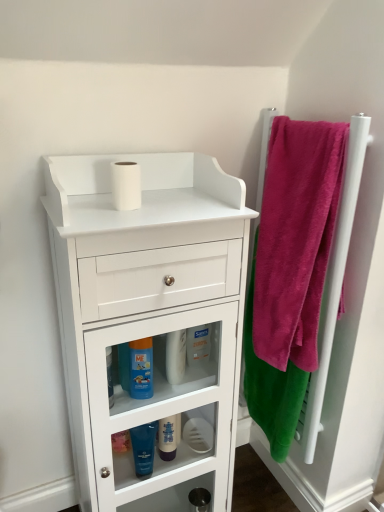
At what (x,y) coordinates should I click in order to perform the action: click on white matte toilet paper at center, which is counted as the 2th toilet paper, starting from the top. Please return your answer as a coordinate pair (x, y). This screenshot has height=512, width=384. Looking at the image, I should click on (198, 435).

What do you see at coordinates (271, 386) in the screenshot?
I see `velvet pink towel at right` at bounding box center [271, 386].

This screenshot has height=512, width=384. What do you see at coordinates (147, 309) in the screenshot?
I see `white matte cabinet at center` at bounding box center [147, 309].

I want to click on translucent plastic mouthwash at lower center, the second mouthwash positioned from the top, so click(x=167, y=438).

Considering the relative positions of blue glossy mouthwash at lower center, positioned as the 3th mouthwash in top-to-bottom order, and white matte toilet paper at center, the 1th toilet paper when ordered from right to left, in the image provided, is blue glossy mouthwash at lower center, positioned as the 3th mouthwash in top-to-bottom order, to the left of white matte toilet paper at center, the 1th toilet paper when ordered from right to left, from the viewer's perspective?

Indeed, blue glossy mouthwash at lower center, positioned as the 3th mouthwash in top-to-bottom order, is positioned on the left side of white matte toilet paper at center, the 1th toilet paper when ordered from right to left.

Considering the positions of points (136, 432) and (188, 440), is point (136, 432) farther from camera compared to point (188, 440)?

No.

From a real-world perspective, is blue glossy mouthwash at lower center, positioned as the 3th mouthwash in top-to-bottom order, beneath white matte toilet paper at center, which is counted as the 2th toilet paper, starting from the top?

No, from a real-world perspective, blue glossy mouthwash at lower center, positioned as the 3th mouthwash in top-to-bottom order, is not below white matte toilet paper at center, which is counted as the 2th toilet paper, starting from the top.

Find the location of `the 3rd mouthwash counting from the left of the white matte toilet paper at center, the 1th toilet paper when ordered from right to left`. the 3rd mouthwash counting from the left of the white matte toilet paper at center, the 1th toilet paper when ordered from right to left is located at coordinates (144, 447).

In the scene shown: Is velvet pink towel at right inside blue glossy mouthwash at lower center, which is the 3th mouthwash in bottom-to-top order?

Actually, velvet pink towel at right is outside blue glossy mouthwash at lower center, which is the 3th mouthwash in bottom-to-top order.

From the image's perspective, which is above, blue glossy mouthwash at lower center, the first mouthwash in the top-to-bottom sequence, or velvet pink towel at right?

velvet pink towel at right, from the image's perspective.

Which is farther from the camera, [142,392] or [255,239]?

Point [255,239]

Are velvet pink towel at right and blue glossy mouthwash at lower center, which is the 3th mouthwash in bottom-to-top order, located far from each other?

No, velvet pink towel at right is not far away from blue glossy mouthwash at lower center, which is the 3th mouthwash in bottom-to-top order.

From the image's perspective, is velvet pink towel at right located above blue glossy mouthwash at lower center, the first mouthwash in the top-to-bottom sequence?

Indeed, from the image's perspective, velvet pink towel at right is shown above blue glossy mouthwash at lower center, the first mouthwash in the top-to-bottom sequence.

Who is bigger, velvet pink towel at right or blue glossy mouthwash at lower center, the first mouthwash in the top-to-bottom sequence?

velvet pink towel at right.

Between velvet pink towel at right and blue glossy mouthwash at lower center, the first mouthwash in the top-to-bottom sequence, which one has more height?

velvet pink towel at right.

Would you say white plastic bottle at center is to the left or to the right of velvet pink towel at right in the picture?

white plastic bottle at center is to the left of velvet pink towel at right.

From a real-world perspective, is white plastic bottle at center on top of velvet pink towel at right?

Correct, in the physical world, white plastic bottle at center is higher than velvet pink towel at right.

How distant is white plastic bottle at center from velvet pink towel at right?

white plastic bottle at center is 13.11 inches away from velvet pink towel at right.

In the scene shown: From the image's perspective, does white plastic bottle at center appear lower than velvet pink towel at right?

No, from the image's perspective, white plastic bottle at center is not below velvet pink towel at right.

Looking at this image, from the image's perspective, is white matte cabinet at center located beneath translucent plastic mouthwash at lower center, the second mouthwash ordered from the bottom?

No, from the image's perspective, white matte cabinet at center is not below translucent plastic mouthwash at lower center, the second mouthwash ordered from the bottom.

There is a translucent plastic mouthwash at lower center, the second mouthwash positioned from the top. At what (x,y) coordinates should I click in order to perform the action: click on the chest of drawers above it (from a real-world perspective). Please return your answer as a coordinate pair (x, y). The height and width of the screenshot is (512, 384). Looking at the image, I should click on (147, 309).

Which is correct: white matte cabinet at center is inside translucent plastic mouthwash at lower center, the second mouthwash positioned from the top, or outside of it?

white matte cabinet at center is spatially situated outside translucent plastic mouthwash at lower center, the second mouthwash positioned from the top.

Is white matte cabinet at center oriented away from translucent plastic mouthwash at lower center, the second mouthwash ordered from the bottom?

That's right, white matte cabinet at center is facing away from translucent plastic mouthwash at lower center, the second mouthwash ordered from the bottom.

Is white matte toilet paper at center, the second toilet paper positioned from the left, spatially inside translucent plastic mouthwash at lower center, the second mouthwash positioned from the top, or outside of it?

white matte toilet paper at center, the second toilet paper positioned from the left, is spatially situated outside translucent plastic mouthwash at lower center, the second mouthwash positioned from the top.

Is translucent plastic mouthwash at lower center, the second mouthwash ordered from the bottom, at the back of white matte toilet paper at center, the second toilet paper positioned from the left?

No, white matte toilet paper at center, the second toilet paper positioned from the left, is not facing away from translucent plastic mouthwash at lower center, the second mouthwash ordered from the bottom.

Based on the photo, in the image, is white matte toilet paper at center, which appears as the first toilet paper when ordered from the bottom, positioned in front of or behind translucent plastic mouthwash at lower center, the second mouthwash positioned from the top?

white matte toilet paper at center, which appears as the first toilet paper when ordered from the bottom, is behind translucent plastic mouthwash at lower center, the second mouthwash positioned from the top.

From a real-world perspective, is white matte toilet paper at center, the second toilet paper positioned from the left, located beneath white matte cabinet at center?

Indeed, from a real-world perspective, white matte toilet paper at center, the second toilet paper positioned from the left, is positioned beneath white matte cabinet at center.

Is white matte toilet paper at center, which is counted as the 1th toilet paper, starting from the back, beside white matte cabinet at center?

white matte toilet paper at center, which is counted as the 1th toilet paper, starting from the back, is not next to white matte cabinet at center, and they're not touching.

Is white matte toilet paper at center, the 1th toilet paper when ordered from right to left, oriented away from white matte cabinet at center?

Yes.

Between white matte toilet paper at center, which is counted as the second toilet paper, starting from the front, and white matte cabinet at center, which one has smaller width?

white matte toilet paper at center, which is counted as the second toilet paper, starting from the front, is thinner.

Locate an element on the screen. Image resolution: width=384 pixels, height=512 pixels. toilet paper below the blue glossy mouthwash at lower center, positioned as the 3th mouthwash in top-to-bottom order (from a real-world perspective) is located at coordinates (198, 435).

Image resolution: width=384 pixels, height=512 pixels. I want to click on bath towel on the right of blue glossy mouthwash at lower center, the first mouthwash in the top-to-bottom sequence, so click(271, 386).

Looking at the image, which one is located further to white matte cabinet at center, white matte toilet paper at center, the 1th toilet paper when ordered from right to left, or velvet pink towel at right?

white matte toilet paper at center, the 1th toilet paper when ordered from right to left, is positioned further to the anchor white matte cabinet at center.

From the image, which object appears to be nearer to velvet pink towel at right, translucent plastic mouthwash at lower center, the second mouthwash ordered from the bottom, or blue glossy mouthwash at lower center, which is the 3th mouthwash in bottom-to-top order?

Among the two, translucent plastic mouthwash at lower center, the second mouthwash ordered from the bottom, is located nearer to velvet pink towel at right.

Considering their positions, is blue glossy mouthwash at lower center, positioned as the 3th mouthwash in top-to-bottom order, positioned further to velvet pink towel at right than white matte cabinet at center?

blue glossy mouthwash at lower center, positioned as the 3th mouthwash in top-to-bottom order, is positioned further to the anchor velvet pink towel at right.

Looking at the image, which one is located closer to white matte toilet paper at upper center, the first toilet paper from the front, blue glossy mouthwash at lower center, positioned as the first mouthwash in bottom-to-top order, or pink soft towel at right?

blue glossy mouthwash at lower center, positioned as the first mouthwash in bottom-to-top order.

From the image, which object appears to be farther from white matte toilet paper at upper center, which is the 2th toilet paper in back-to-front order, white matte cabinet at center or velvet pink towel at right?

velvet pink towel at right lies further to white matte toilet paper at upper center, which is the 2th toilet paper in back-to-front order, than the other object.

Considering their positions, is white plastic bottle at center positioned closer to blue glossy mouthwash at lower center, positioned as the first mouthwash in bottom-to-top order, than velvet pink towel at right?

The object closer to blue glossy mouthwash at lower center, positioned as the first mouthwash in bottom-to-top order, is white plastic bottle at center.

Looking at the image, which one is located further to velvet pink towel at right, white matte cabinet at center or white plastic bottle at center?

The object further to velvet pink towel at right is white plastic bottle at center.

Considering their positions, is white matte toilet paper at upper center, which is the 2th toilet paper in back-to-front order, positioned closer to blue glossy mouthwash at lower center, positioned as the first mouthwash in bottom-to-top order, than translucent plastic mouthwash at lower center, the second mouthwash ordered from the bottom?

translucent plastic mouthwash at lower center, the second mouthwash ordered from the bottom, is positioned closer to the anchor blue glossy mouthwash at lower center, positioned as the first mouthwash in bottom-to-top order.

At what (x,y) coordinates should I click in order to perform the action: click on toilet paper between blue glossy mouthwash at lower center, which is the 3th mouthwash in bottom-to-top order, and velvet pink towel at right, in the horizontal direction. Please return your answer as a coordinate pair (x, y). This screenshot has width=384, height=512. Looking at the image, I should click on (198, 435).

Locate an element on the screen. bath towel between translucent plastic mouthwash at lower center, the second mouthwash positioned from the top, and pink soft towel at right is located at coordinates (271, 386).

Locate an element on the screen. The image size is (384, 512). bath towel between white matte toilet paper at upper center, which is the 1th toilet paper from left to right, and blue glossy mouthwash at lower center, positioned as the first mouthwash in bottom-to-top order, vertically is located at coordinates (271, 386).

Find the location of a particular element. chest of drawers between white matte toilet paper at upper center, acting as the 2th toilet paper starting from the right, and pink soft towel at right is located at coordinates (147, 309).